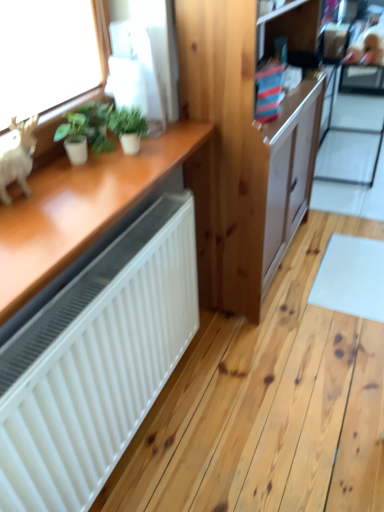
The width and height of the screenshot is (384, 512). Find the location of `free point below transparent glass screen door at upper right (from a real-world perspective)`. free point below transparent glass screen door at upper right (from a real-world perspective) is located at coordinates (359, 155).